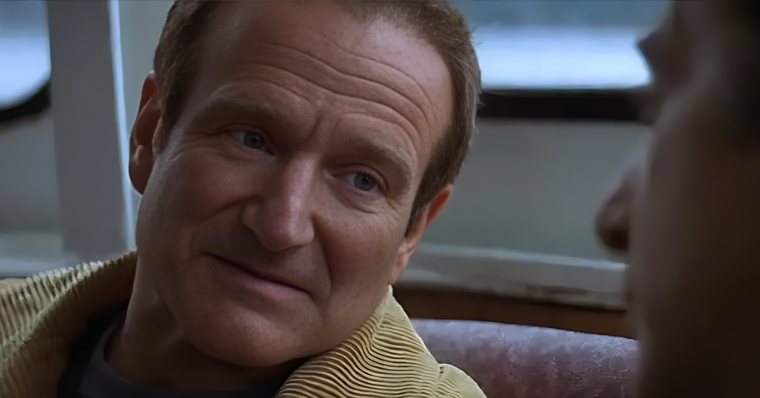
The width and height of the screenshot is (760, 398). Identify the location of wall. (526, 169).